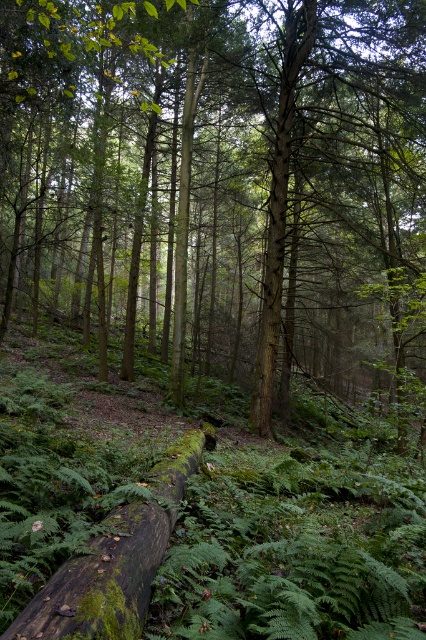
Question: Does green rough bark tree at center have a greater width compared to green mossy log at center?

Choices:
 (A) yes
 (B) no

Answer: (A)

Question: Can you confirm if green rough bark tree at center is smaller than green mossy log at center?

Choices:
 (A) no
 (B) yes

Answer: (A)

Question: Among these objects, which one is nearest to the camera?

Choices:
 (A) green mossy log at center
 (B) green rough bark tree at center

Answer: (A)

Question: Which object appears farthest from the camera in this image?

Choices:
 (A) green mossy log at center
 (B) green rough bark tree at center

Answer: (B)

Question: In this image, where is green rough bark tree at center located relative to green mossy log at center?

Choices:
 (A) above
 (B) below

Answer: (A)